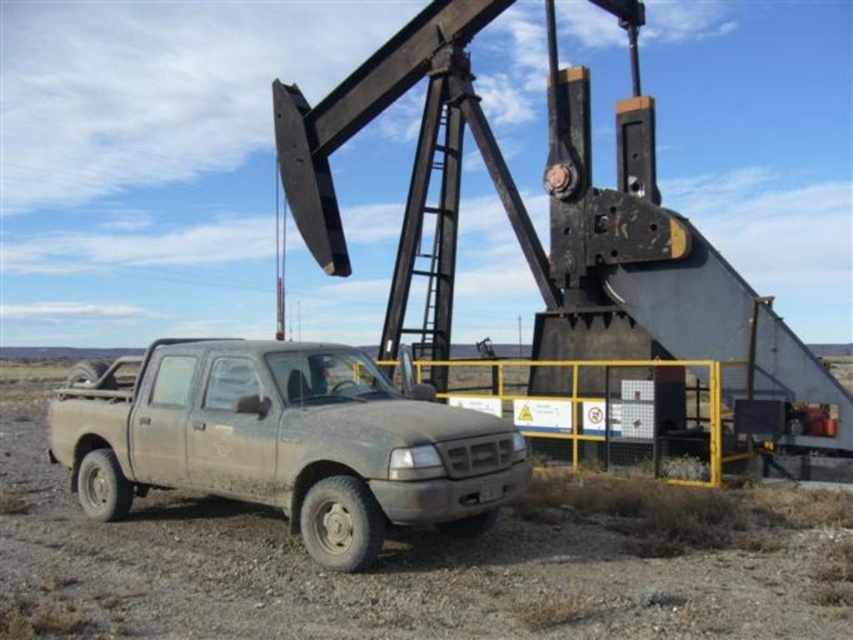
Is point (155, 504) behind point (155, 426)?

Yes, point (155, 504) is behind point (155, 426).

Which is above, dull gray dirt field at center or dusty matte pickup truck at lower left?

dusty matte pickup truck at lower left is above.

Is point (160, 572) behind point (367, 371)?

No, (160, 572) is closer to viewer.

You are a GUI agent. You are given a task and a screenshot of the screen. Output one action in this format:
    pyautogui.click(x=<x>, y=<y>)
    Task: Click on the dull gray dirt field at center
    
    Given the screenshot: What is the action you would take?
    pyautogui.click(x=428, y=561)